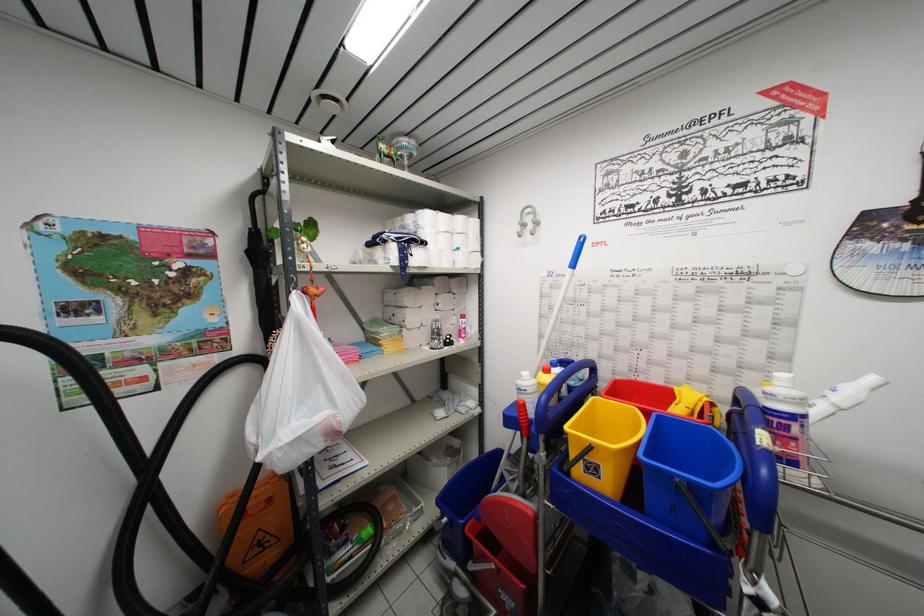
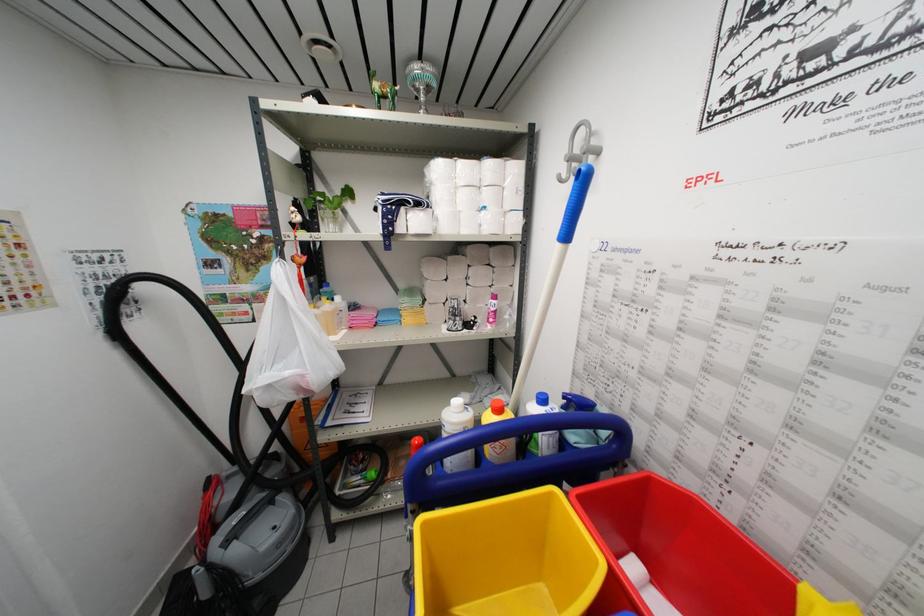
Find the pixel in the second image that matches the point at 462,411 in the first image.

(490, 402)